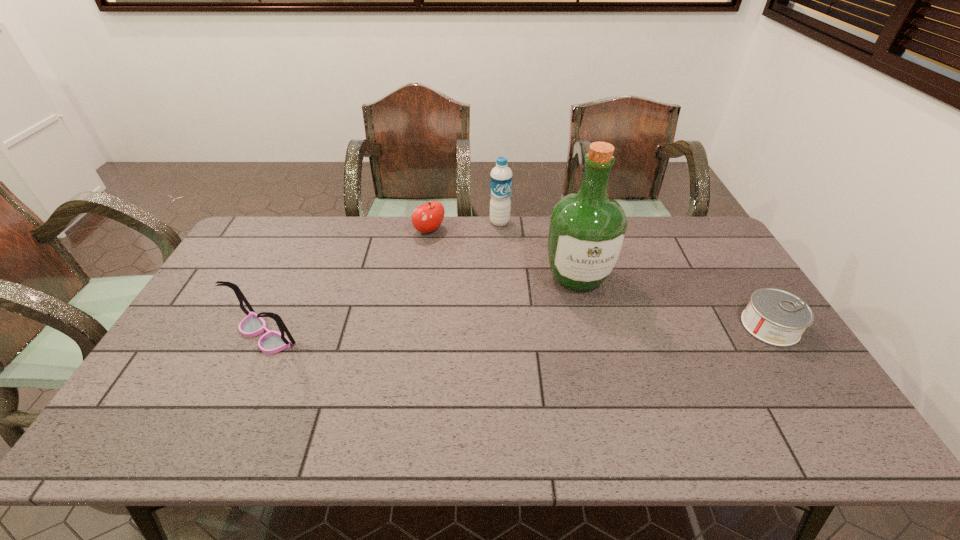
The image size is (960, 540). I want to click on free space on the desktop that is between the leftmost object and the shortest object and is positioned on the label of the water bottle, so click(x=536, y=330).

In order to click on vacant space on the desktop that is between the spectacles and the can and is positioned on the stem of the second object from left to right in this screenshot , I will do `click(532, 330)`.

I want to click on free space on the desktop that is between the spectacles and the shortest object and is positioned on the front-facing side of the second object from right to left, so click(593, 329).